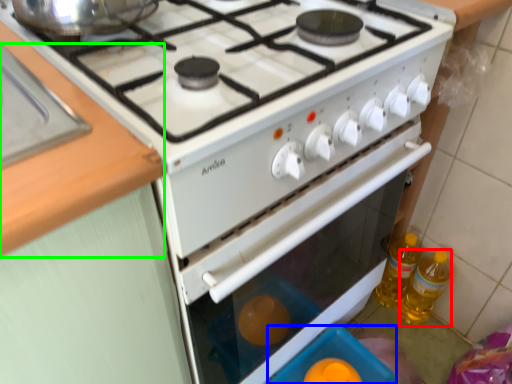
Question: Which object is positioned farthest from bottle (highlighted by a red box)? Select from appliance (highlighted by a blue box) and counter top (highlighted by a green box).

Choices:
 (A) appliance
 (B) counter top

Answer: (B)